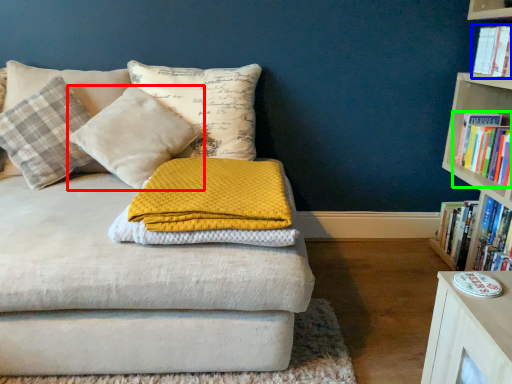
Question: Which object is positioned farthest from pillow (highlighted by a red box)? Select from book (highlighted by a blue box) and book (highlighted by a green box).

Choices:
 (A) book
 (B) book

Answer: (A)